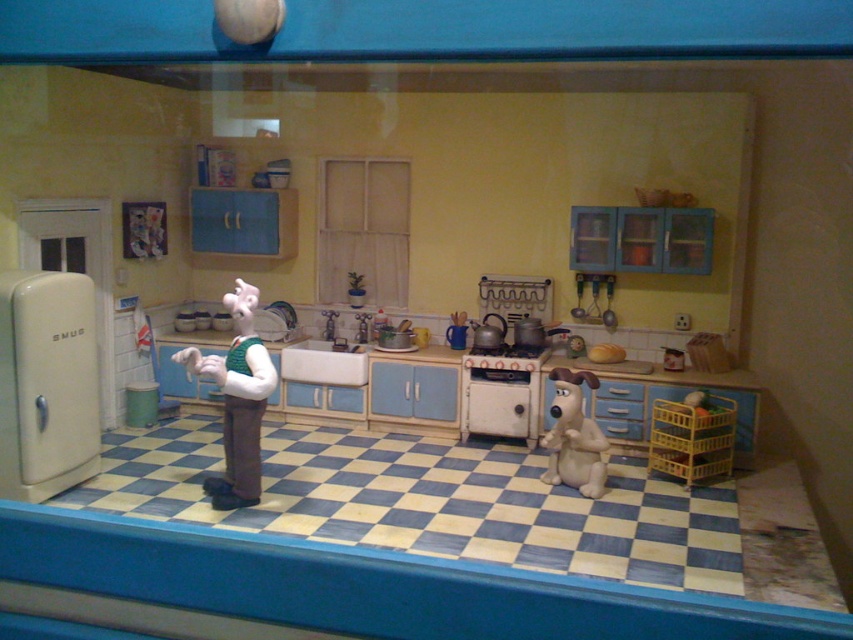
Does cream matte refrigerator at left have a lesser height compared to white plush toy at center?

In fact, cream matte refrigerator at left may be taller than white plush toy at center.

I want to click on cream matte refrigerator at left, so click(45, 384).

Is cream matte refrigerator at left thinner than fuzzy beige dog at center?

Correct, cream matte refrigerator at left's width is less than fuzzy beige dog at center's.

Is point (90, 368) behind point (569, 480)?

No, (90, 368) is closer to viewer.

Between point (19, 406) and point (578, 403), which one is positioned in front?

Point (19, 406) is in front.

Identify the location of cream matte refrigerator at left. (45, 384).

Which is in front, point (236, 282) or point (547, 476)?

Point (236, 282) is more forward.

Who is lower down, white plush toy at center or fuzzy beige dog at center?

fuzzy beige dog at center is below.

Does point (236, 401) lie in front of point (556, 460)?

Yes, it is.

Image resolution: width=853 pixels, height=640 pixels. I want to click on white plush toy at center, so click(236, 401).